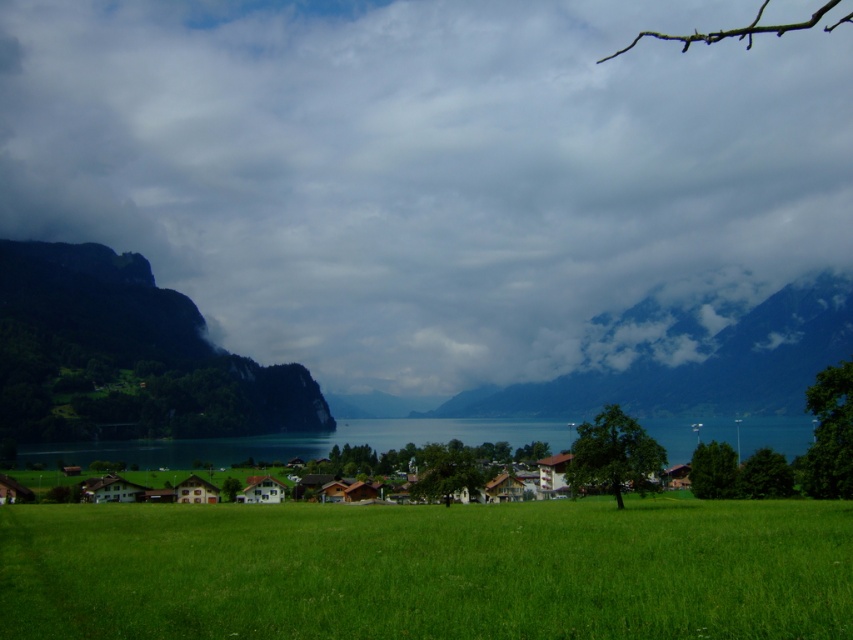
Question: Does cloudy gray mountain at center appear over brown wooden houses at center?

Choices:
 (A) yes
 (B) no

Answer: (A)

Question: Is green mossy cliff at left thinner than brown wooden houses at center?

Choices:
 (A) no
 (B) yes

Answer: (B)

Question: Among these points, which one is nearest to the camera?

Choices:
 (A) [138, 301]
 (B) [99, 81]

Answer: (A)

Question: Among these points, which one is farthest from the camera?

Choices:
 (A) (511, 436)
 (B) (680, 465)
 (C) (654, 406)
 (D) (170, 144)

Answer: (D)

Question: Which is farther from the cloudy gray mountain at center?

Choices:
 (A) brown wooden houses at center
 (B) green grassy field at center

Answer: (B)

Question: Can you confirm if cloudy gray mountain at center is smaller than brown wooden houses at center?

Choices:
 (A) yes
 (B) no

Answer: (A)